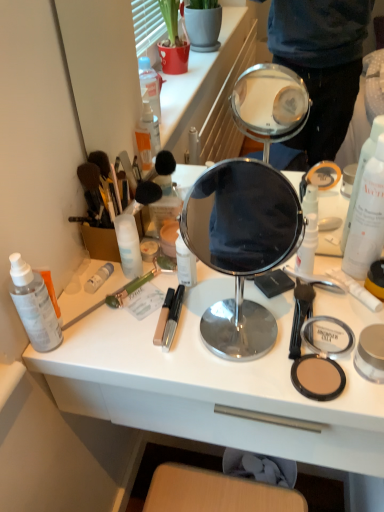
You are a GUI agent. You are given a task and a screenshot of the screen. Output one action in this format:
    pyautogui.click(x=<x>, y=<y>)
    Task: Click on the vacant space in between green plastic brush at lower left and white matte spray bottle at right
    
    Given the screenshot: What is the action you would take?
    pyautogui.click(x=208, y=293)